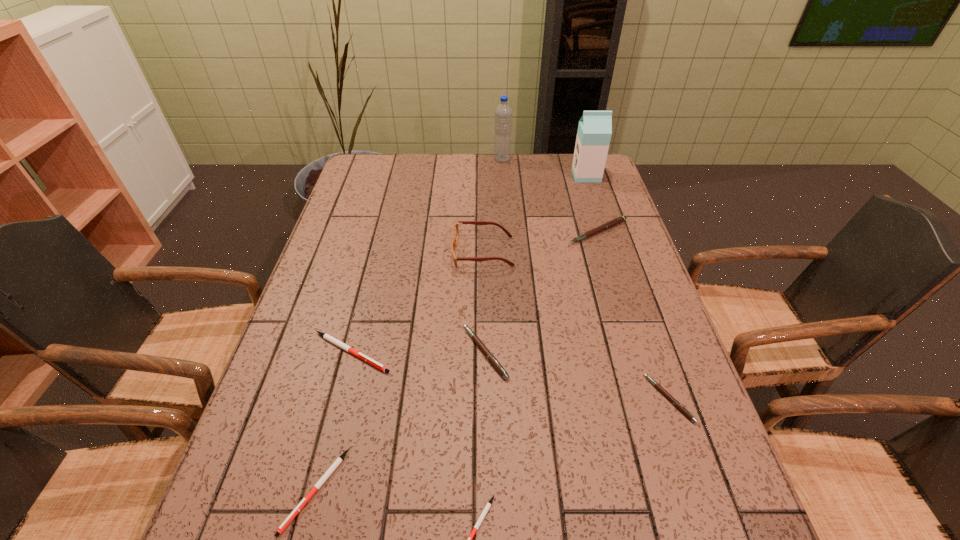
The image size is (960, 540). In order to click on the smallest pink pen in this screenshot , I will do `click(678, 405)`.

Find the location of a particular element. The image size is (960, 540). the second biggest white pen is located at coordinates (288, 520).

Locate an element on the screen. free space located 0.370m on the front of the farthest object is located at coordinates (507, 224).

Find the location of a particular element. This screenshot has width=960, height=540. vacant space located 0.050m on the back of the white milk carton is located at coordinates (582, 162).

Find the location of a particular element. Image resolution: width=960 pixels, height=540 pixels. free space located on the front-facing side of the brown spectacles is located at coordinates (366, 252).

The image size is (960, 540). What are the coordinates of `vacant space located 0.220m on the front-facing side of the brown spectacles` in the screenshot? It's located at (376, 252).

What are the coordinates of `vacant region located on the front-facing side of the brown spectacles` in the screenshot? It's located at (428, 252).

The width and height of the screenshot is (960, 540). I want to click on vacant space located at the nib of the farthest pen, so click(x=615, y=286).

Locate an element on the screen. The width and height of the screenshot is (960, 540). free space located 0.190m at the nib of the leftmost pink pen is located at coordinates (381, 353).

You are a GUI agent. You are given a task and a screenshot of the screen. Output one action in this format:
    pyautogui.click(x=<x>, y=<y>)
    Task: Click on the blank space located at the nib of the leftmost pink pen
    This screenshot has width=960, height=540.
    Given the screenshot: What is the action you would take?
    pyautogui.click(x=359, y=353)